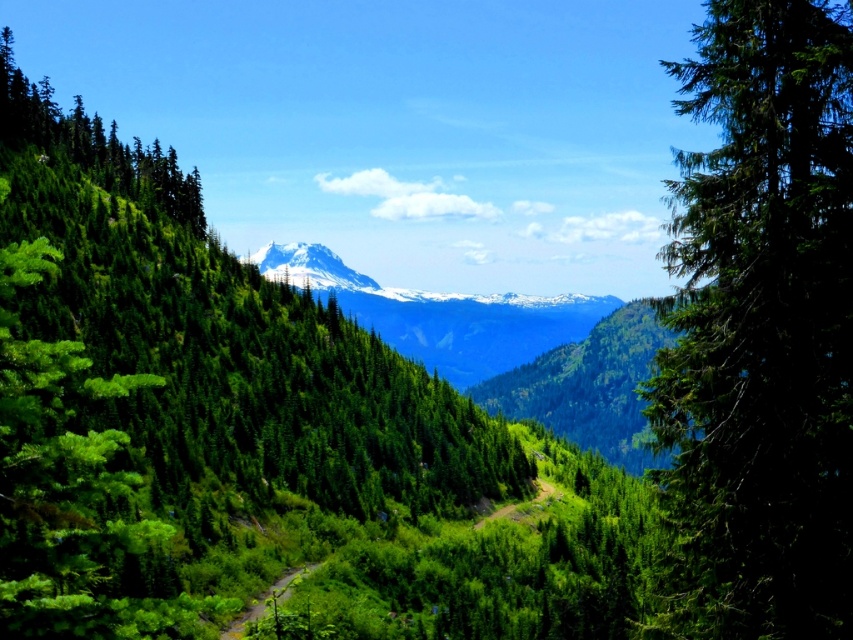
You are planning a photography shoot in this landscape and want to capture both the green glossy tree at left and the snowy rocky mountain range at center in the same frame. Considering their sizes, which object will appear smaller in the final photo?

The green glossy tree at left will appear smaller in the final photo because it has a smaller size compared to the snowy rocky mountain range at center.

You are a hiker standing at the starting point of the trail. You see two points marked on your map as point (698, 112) and point (500, 307). Which point is closer to you?

Point (698, 112) is in front of point (500, 307), so it is closer to you.